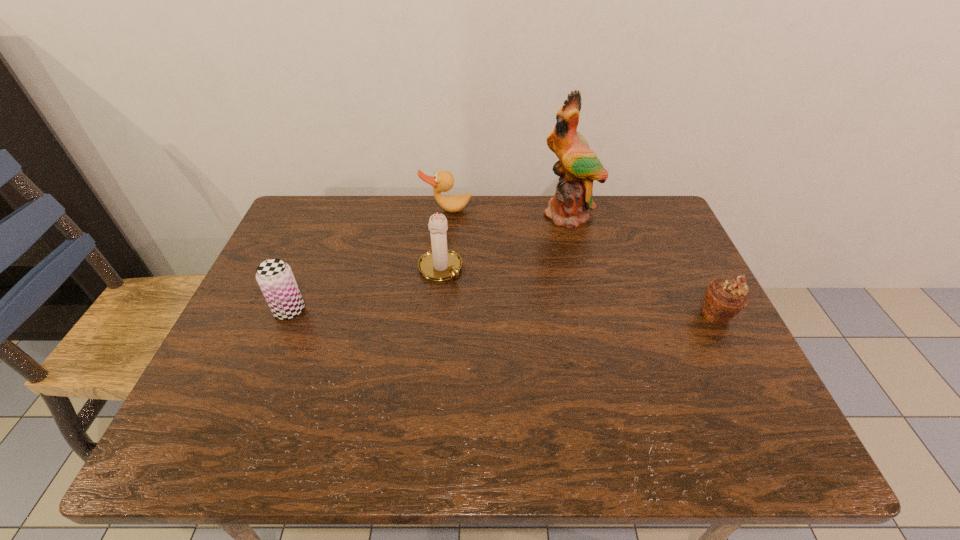
You are a GUI agent. You are given a task and a screenshot of the screen. Output one action in this format:
    pyautogui.click(x=<x>, y=<y>)
    Task: Click on the leftmost object
    
    Given the screenshot: What is the action you would take?
    pyautogui.click(x=276, y=280)

Locate an element on the screen. Image resolution: width=960 pixels, height=540 pixels. the rightmost object is located at coordinates (724, 299).

The width and height of the screenshot is (960, 540). Identify the location of parrot. (578, 166).

At what (x,y) coordinates should I click in order to perform the action: click on the tallest object. Please return your answer as a coordinate pair (x, y). Looking at the image, I should click on (578, 166).

In order to click on duck in this screenshot , I will do `click(443, 181)`.

Where is `the fourth shortest object`? The image size is (960, 540). the fourth shortest object is located at coordinates (439, 264).

You are a GUI agent. You are given a task and a screenshot of the screen. Output one action in this format:
    pyautogui.click(x=<x>, y=<y>)
    Task: Click on the third nearest object
    This screenshot has height=540, width=960.
    Given the screenshot: What is the action you would take?
    pyautogui.click(x=439, y=264)

Find the location of a particular element. Image resolution: width=960 pixels, height=540 pixels. vacant space located 0.090m on the front of the leftmost object is located at coordinates (272, 353).

Identify the location of vacant area situated 0.170m on the left of the rightmost object. This screenshot has height=540, width=960. (629, 314).

Identify the location of free space located 0.200m on the front-facing side of the second object from right to left. pos(554,273).